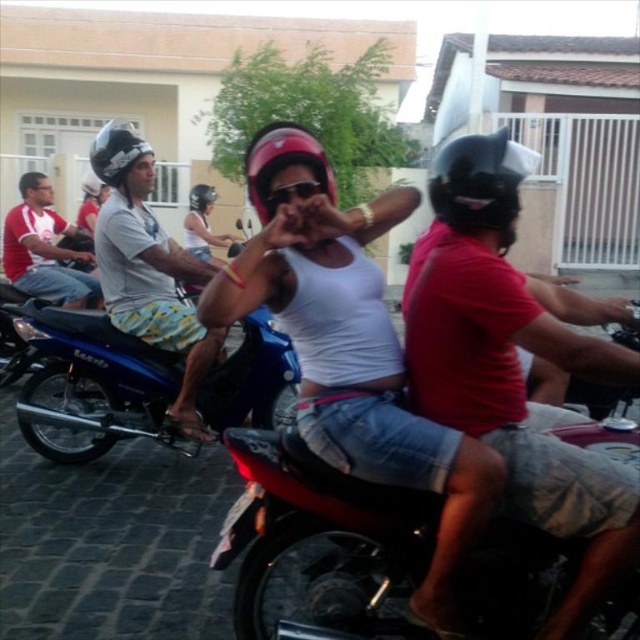
You are a photographer standing in the middle of the street. You want to take a photo of the blue metallic motorcycle at center and the matte white shirt at left. Which object should you zoom in on to capture both subjects without cropping either?

You should zoom in on the blue metallic motorcycle at center because it is shorter than the matte white shirt at left, so adjusting the camera angle to focus on the motorcycle while still including the shirt would be feasible.

You are standing in the street scene and want to reach the point marked as point [100,170]. If you can walk 12 feet in a minute, how long will it take you to reach that point?

The point [100,170] is 10.10 feet from the viewer. Since you can walk 12 feet in a minute, it will take approximately 0.84 minutes, which is about 50 seconds, to reach the point.